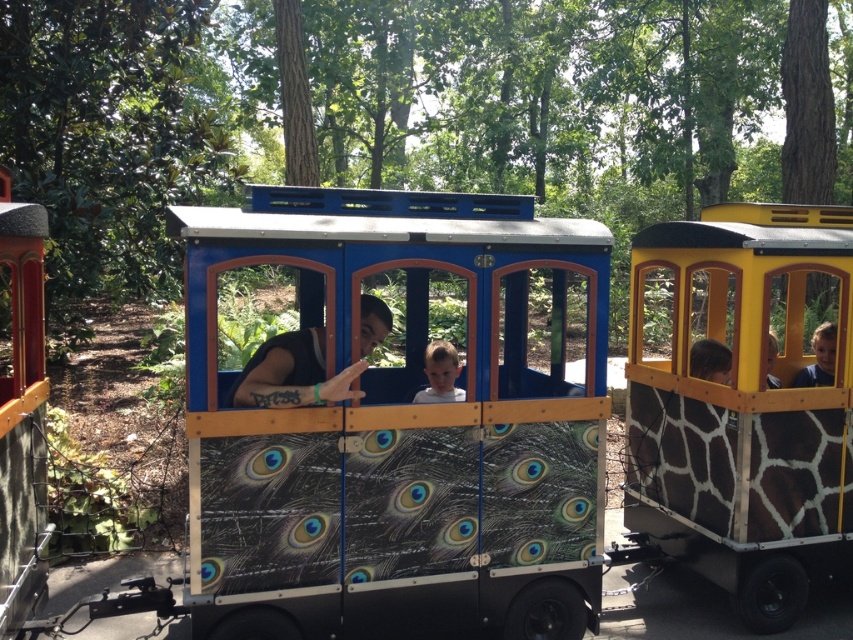
You are a photographer taking a picture of the smooth brown hair at right and the light brown wooden face at center. Which object should you focus on first to ensure it appears sharp in the photo?

You should focus on the smooth brown hair at right first because it is closer to the viewer than the light brown wooden face at center.